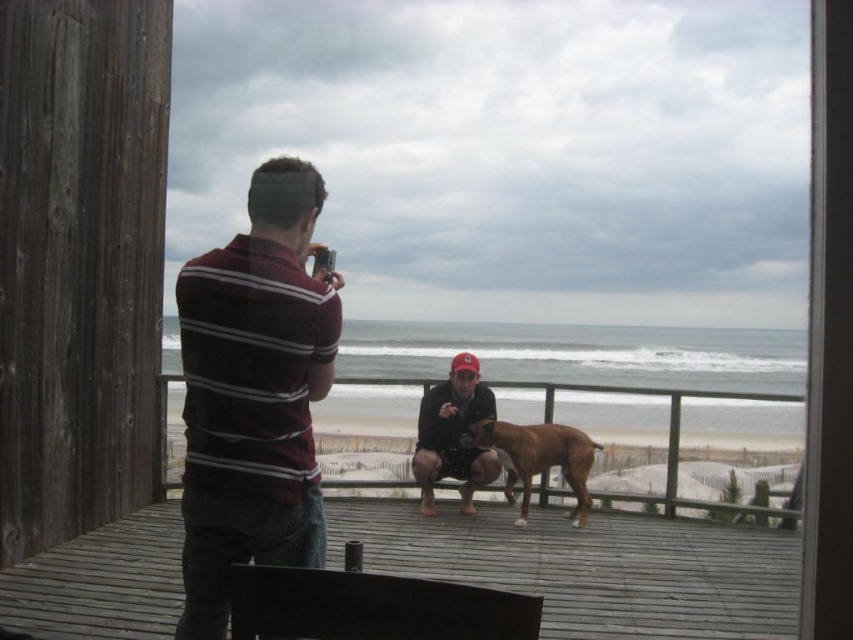
The image size is (853, 640). Describe the element at coordinates (254, 394) in the screenshot. I see `maroon striped shirt at left` at that location.

Is maroon striped shirt at left bigger than brown glossy dog at center?

Indeed, maroon striped shirt at left has a larger size compared to brown glossy dog at center.

Is point (280, 292) closer to camera compared to point (500, 445)?

Yes, point (280, 292) is closer to viewer.

Locate an element on the screen. The image size is (853, 640). maroon striped shirt at left is located at coordinates (254, 394).

Describe the element at coordinates (592, 566) in the screenshot. I see `wooden deck at center` at that location.

Who is positioned more to the right, wooden deck at center or brown glossy dog at center?

brown glossy dog at center is more to the right.

Between point (550, 548) and point (523, 460), which one is positioned in front?

Point (550, 548) is in front.

I want to click on wooden deck at center, so click(592, 566).

Is matte black jacket at center above brown glossy dog at center?

Indeed, matte black jacket at center is positioned over brown glossy dog at center.

The height and width of the screenshot is (640, 853). Describe the element at coordinates (453, 435) in the screenshot. I see `matte black jacket at center` at that location.

Does point (434, 419) come closer to viewer compared to point (534, 433)?

That is False.

What are the coordinates of `matte black jacket at center` in the screenshot? It's located at (453, 435).